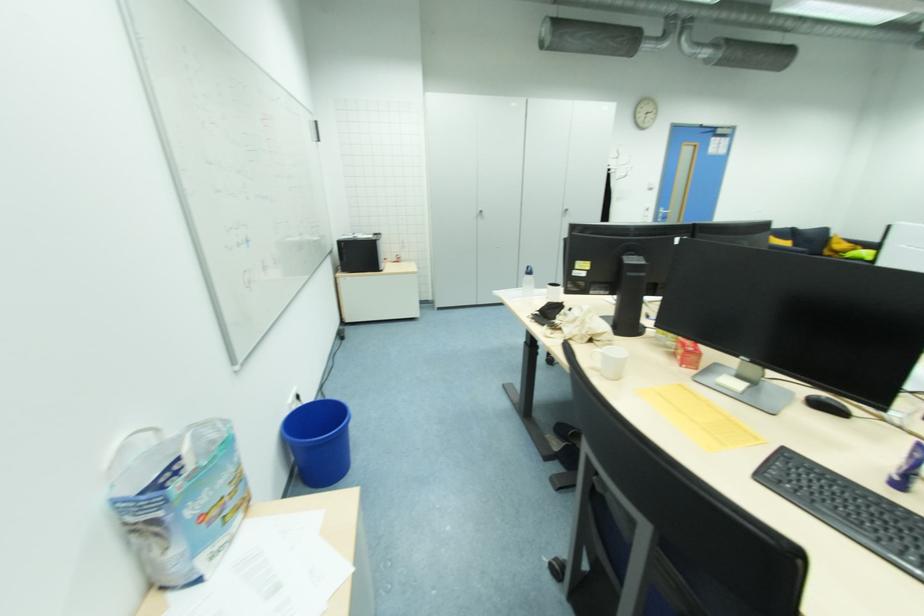
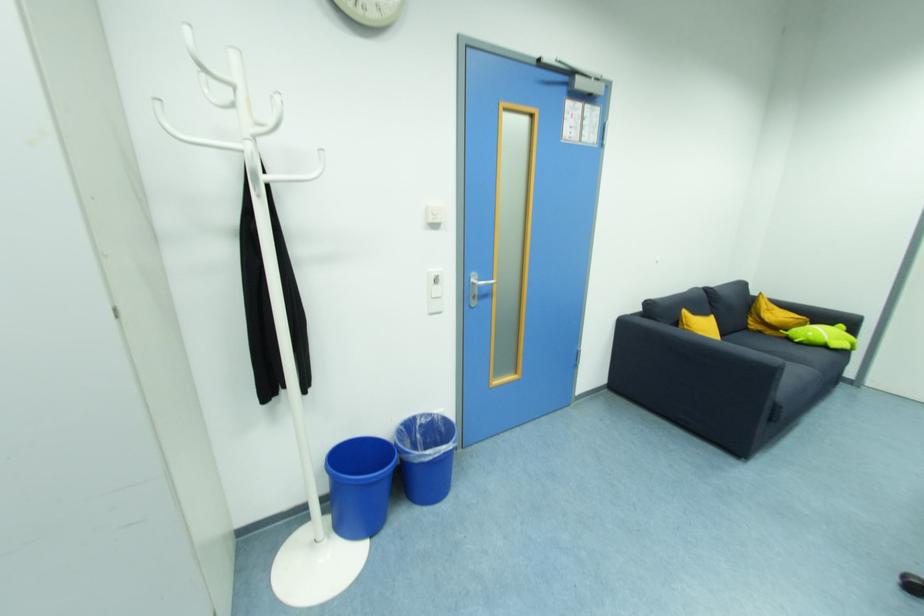
Based on the photo, the images are taken continuously from a first-person perspective. In which direction are you moving?

The movement direction of the cameraman is right, forward.